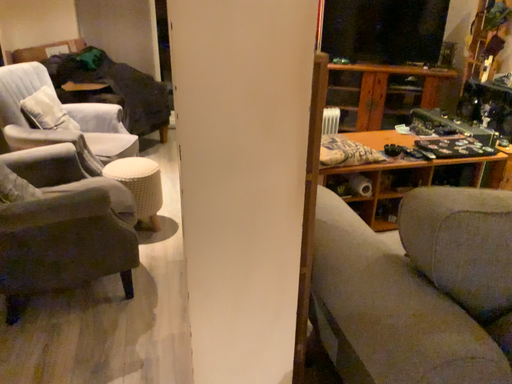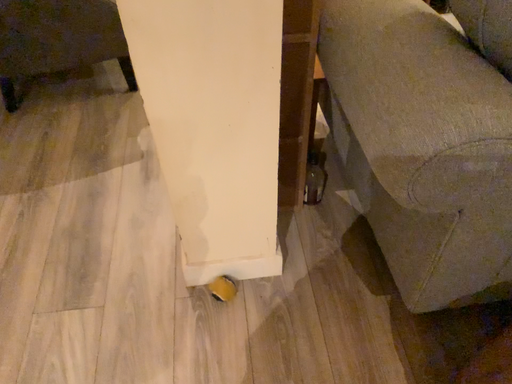
Question: How did the camera likely rotate when shooting the video?

Choices:
 (A) rotated downward
 (B) rotated upward

Answer: (A)